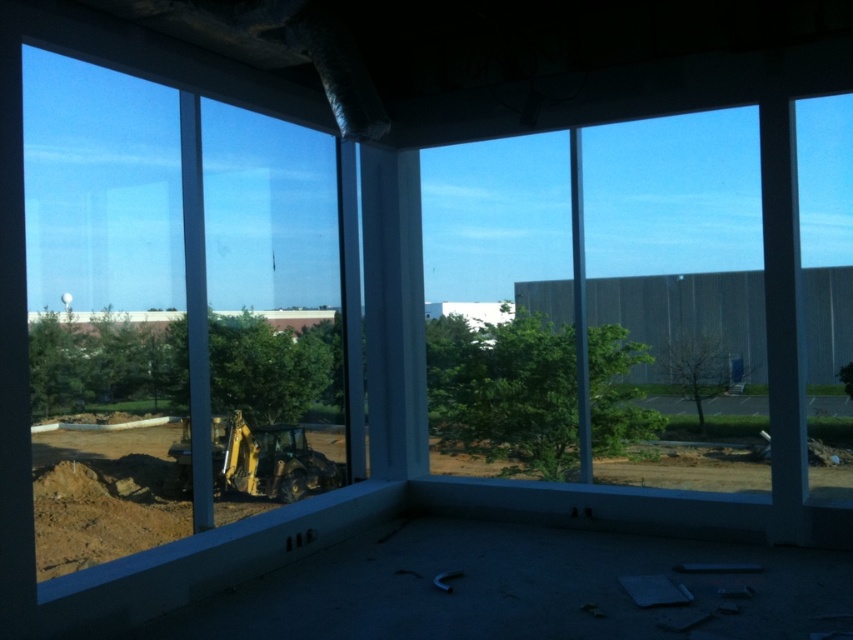
You are standing in the construction site and see two points marked in the image. Which point is closer to you, point (x=502, y=474) or point (x=238, y=468)?

Point (x=238, y=468) is closer to you because it is less further to the viewer than point (x=502, y=474).

You are standing in the construction site and want to reach the two points marked in the image. Which point, point (181, 125) or point (659, 230), is closer to you?

Answer: Point (181, 125) is closer to the viewer than point (659, 230).